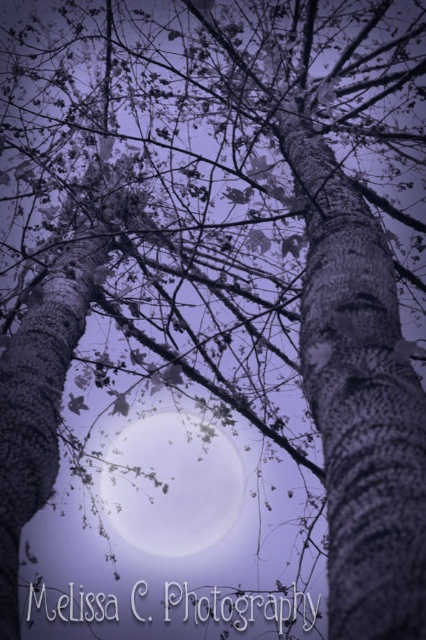
You are standing in the night scene and want to reach the point marked at coordinates point (330, 356). Considering the two birch trees framing the scene, which direction should you move to get closer to that point?

The point marked at coordinates point (330, 356) is 6.32 feet away from the viewer. To reach it, move forward towards the center of the scene between the two birch trees, as the point is positioned centrally behind them.

You are an astronomer observing the night sky through a telescope. You notice two objects in your viewfinder, the smooth bark tree trunk at center and the translucent glass moon at center. Which object is closer to you according to the image?

The smooth bark tree trunk at center is positioned over the translucent glass moon at center, so it is closer to you.

From the picture: You are standing in the night scene and want to touch the smooth bark tree trunk at center. Based on its position coordinates, which direction should you move to reach it?

The smooth bark tree trunk at center is located at point 0.625 on the x and 0.843 on the y axis. Since the coordinates are relative to the image, moving towards the right and down would align with the x and y values, so you should move to the right and downward to reach it.